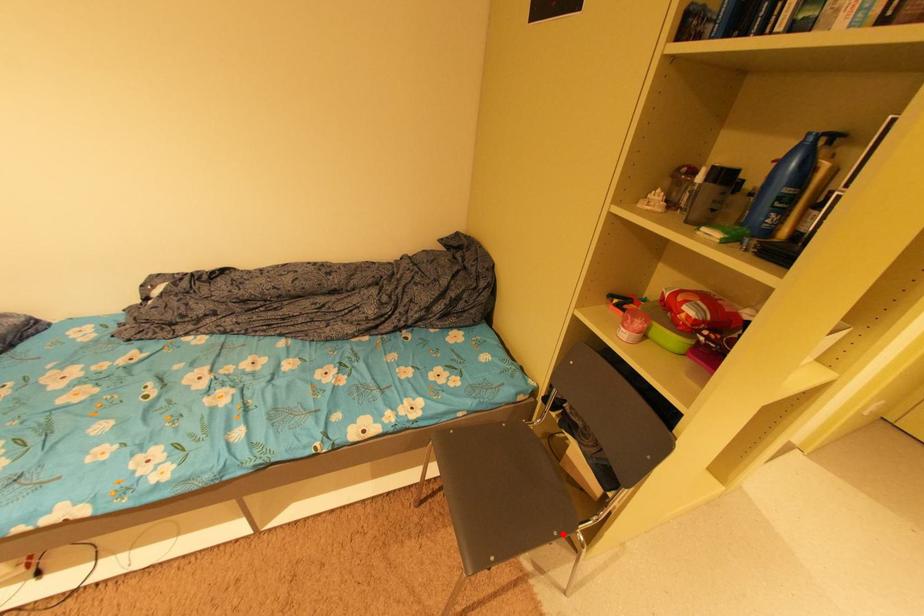
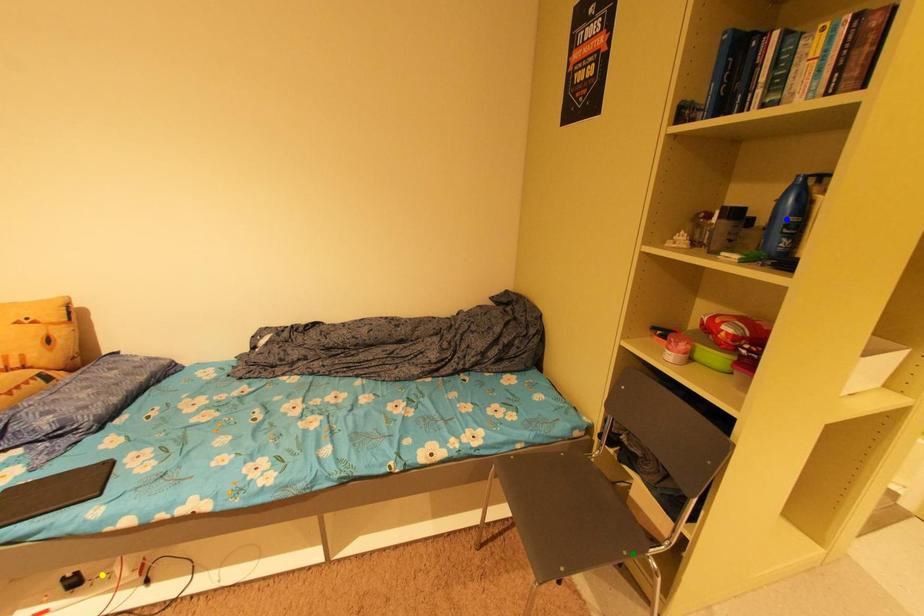
Question: I am providing you with two images of the same scene from different viewpoints. A red point is marked on the first image. You are given multiple points on the second image. Can you choose the point in image 2 that corresponds to the point in image 1?

Choices:
 (A) green point
 (B) blue point
 (C) yellow point

Answer: (A)